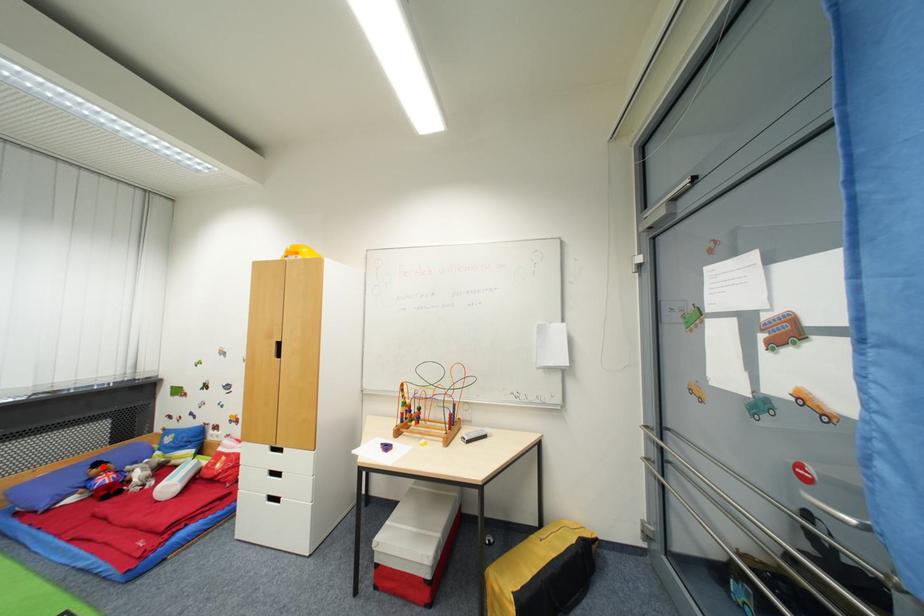
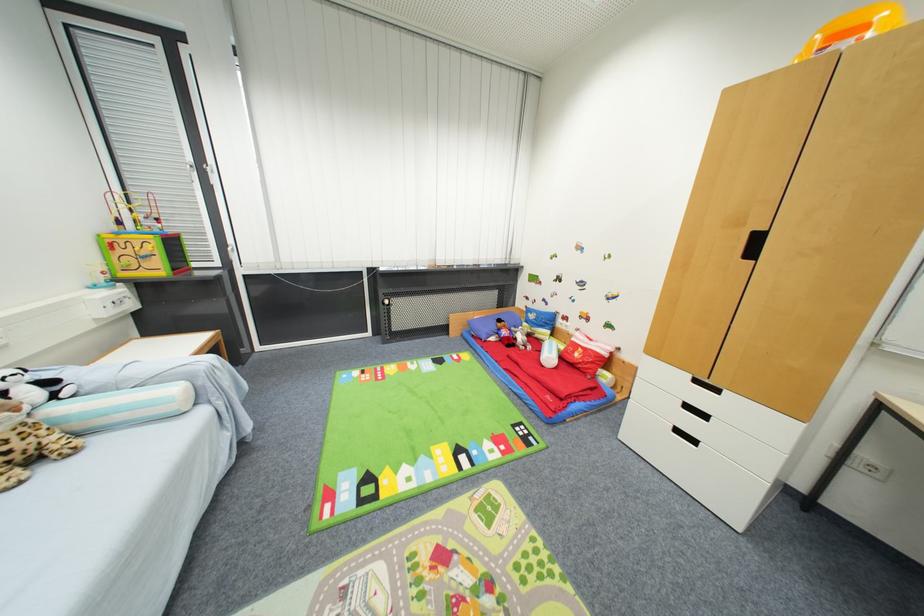
The point at the highlighted location is marked in the first image. Where is the corresponding point in the second image?

(505, 323)